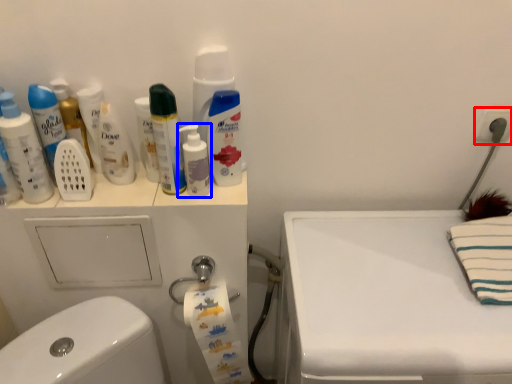
Question: Which point is closer to the camera, electric outlet (highlighted by a red box) or mouthwash (highlighted by a blue box)?

Choices:
 (A) electric outlet
 (B) mouthwash

Answer: (B)